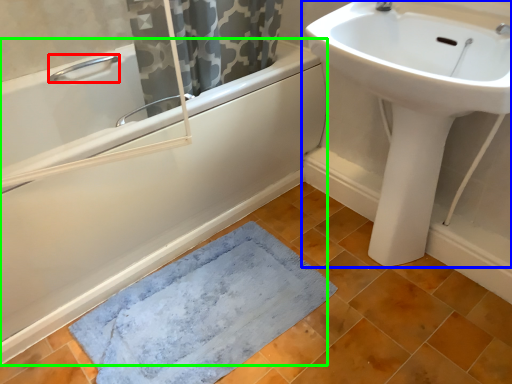
Question: Which object is positioned closest to plumbing fixture (highlighted by a red box)? Select from sink (highlighted by a blue box) and bathtub (highlighted by a green box).

Choices:
 (A) sink
 (B) bathtub

Answer: (B)